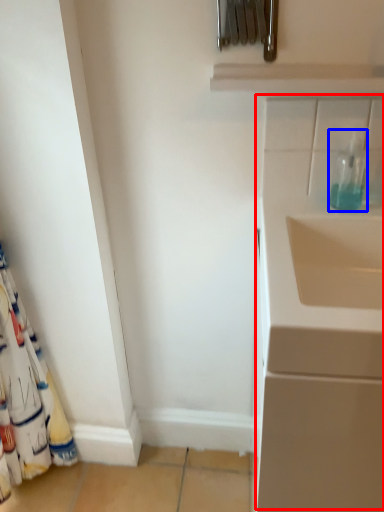
Question: Among these objects, which one is nearest to the camera, wide (highlighted by a red box) or bottle (highlighted by a blue box)?

Choices:
 (A) wide
 (B) bottle

Answer: (A)